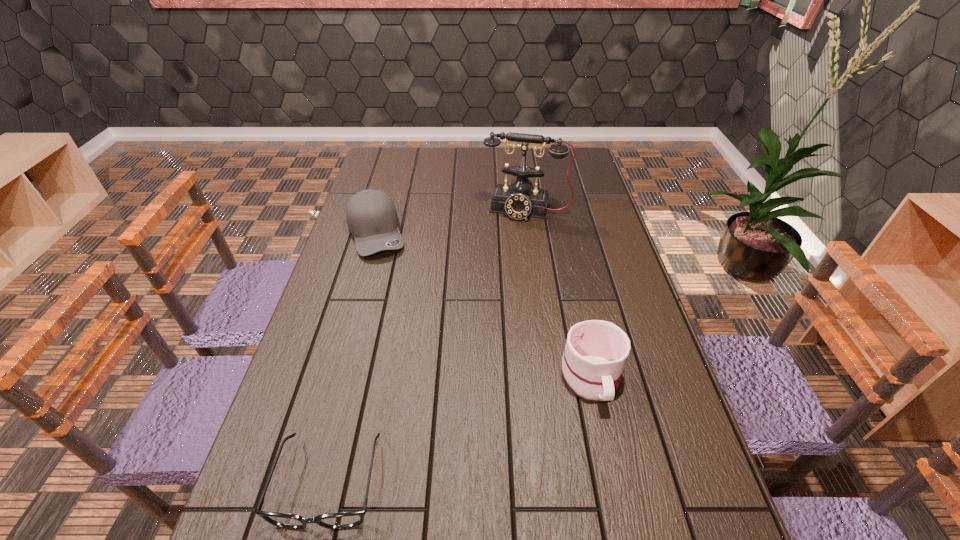
This screenshot has height=540, width=960. In order to click on free region located on the dial of the tallest object in this screenshot , I will do `click(516, 231)`.

Locate an element on the screen. free space located 0.400m on the dial of the tallest object is located at coordinates (497, 303).

Locate an element on the screen. object that is positioned at the near edge is located at coordinates (343, 520).

The width and height of the screenshot is (960, 540). I want to click on spectacles located in the left edge section of the desktop, so click(343, 520).

Identify the location of baseball cap that is at the left edge. The height and width of the screenshot is (540, 960). (371, 216).

The width and height of the screenshot is (960, 540). What are the coordinates of `mug located in the right edge section of the desktop` in the screenshot? It's located at (596, 351).

Find the location of a particular element. telephone at the right edge is located at coordinates (520, 200).

This screenshot has height=540, width=960. I want to click on object that is at the near left corner, so click(x=343, y=520).

Find the location of a particular element. free space at the far edge of the desktop is located at coordinates (516, 159).

In the image, there is a desktop. Identify the location of free space at the left edge. (334, 363).